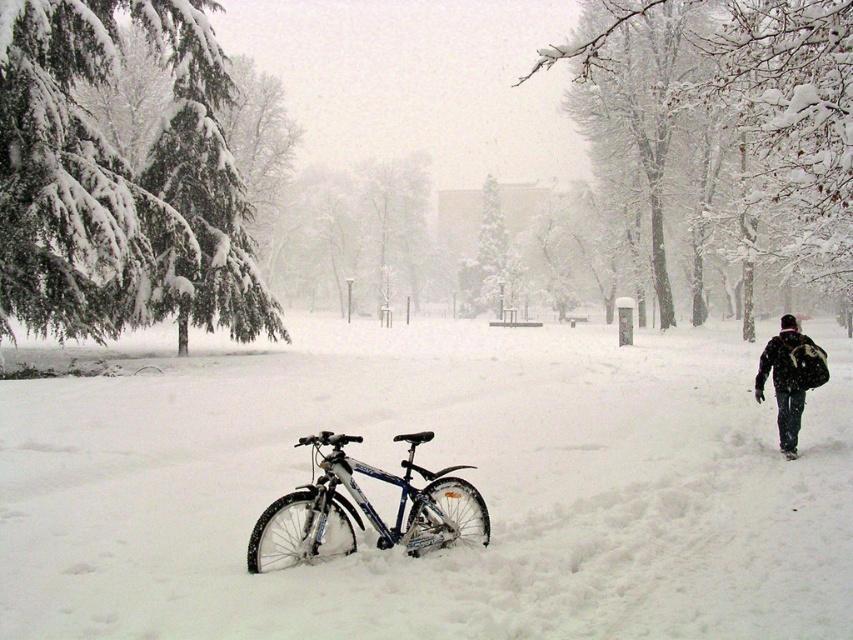
Question: Which point is farther from the camera taking this photo?

Choices:
 (A) (241, 252)
 (B) (804, 333)
 (C) (755, 93)
 (D) (715, 413)

Answer: (A)

Question: Can you confirm if snow-covered evergreen at left is wider than dark blue jeans at lower right?

Choices:
 (A) yes
 (B) no

Answer: (A)

Question: Which object is the farthest from the snow-covered tree at upper center?

Choices:
 (A) shiny metallic bicycle at center
 (B) white matte snow at center
 (C) dark blue jeans at lower right
 (D) snow-covered evergreen at left

Answer: (C)

Question: Can you confirm if snow-covered tree at upper center is bigger than shiny metallic bicycle at center?

Choices:
 (A) no
 (B) yes

Answer: (B)

Question: Which point is closer to the camera?

Choices:
 (A) (729, 38)
 (B) (178, 42)
 (C) (368, 474)

Answer: (C)

Question: Does shiny metallic bicycle at center appear under dark blue jeans at lower right?

Choices:
 (A) no
 (B) yes

Answer: (B)